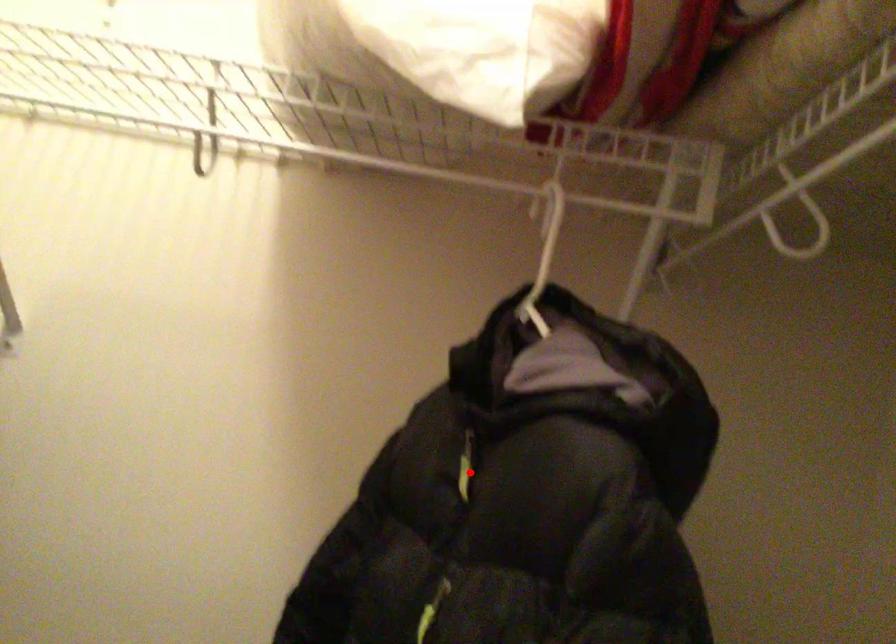
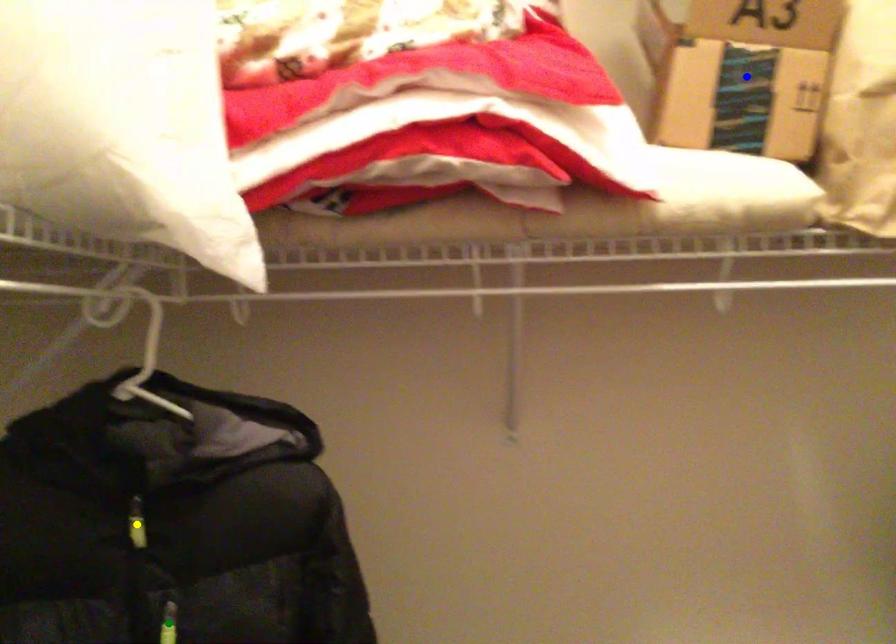
Question: I am providing you with two images of the same scene from different viewpoints. A red point is marked on the first image. You are given multiple points on the second image. Which point in image 2 is actually the same real-world point as the red point in image 1?

Choices:
 (A) green point
 (B) yellow point
 (C) blue point

Answer: (B)